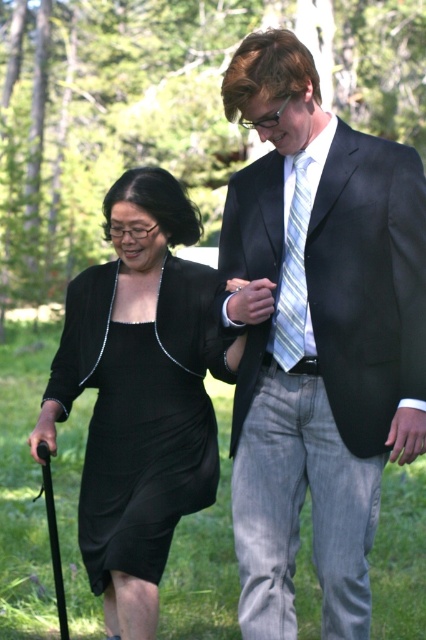
Based on the photo, you are a delivery drone trying to navigate between two points in the image. The first point is point (245, 396) and the second point is point (124, 474). Which point should you fly towards first if you want to follow the path that the older woman is walking?

Point (245, 396) is in front of point (124, 474), so you should fly towards point (245, 396) first as it is closer to the older woman walking path.

You are a fashion designer observing the two items in the image. You need to determine which item requires more fabric to produce between the black satin dress at left and the striped fabric tie at center. Which one would you choose?

The black satin dress at left is bigger than the striped fabric tie at center, so it would require more fabric to produce.

You are a photographer trying to capture a clear photo of both the matte black suit at center and the black satin dress at left. Which object should you focus on first to ensure both are in focus?

You should focus on the matte black suit at center first because it is closer to the viewer than the black satin dress at left, so adjusting focus from near to far will help both be in focus.